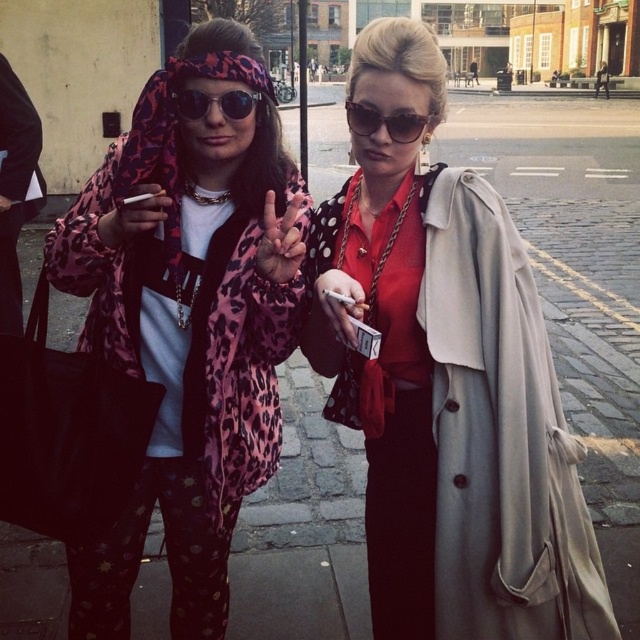
Locate an element on the screen. Image resolution: width=640 pixels, height=640 pixels. matte pink leopard print hand at left is located at coordinates (136, 214).

Is light beige fabric trench coat at center thinner than matte pink leopard print hand at left?

Incorrect, light beige fabric trench coat at center's width is not less than matte pink leopard print hand at left's.

Can you confirm if light beige fabric trench coat at center is taller than matte pink leopard print hand at left?

Yes.

Image resolution: width=640 pixels, height=640 pixels. Identify the location of light beige fabric trench coat at center. click(500, 436).

The image size is (640, 640). Identify the location of light beige fabric trench coat at center. (500, 436).

Which is behind, point (268, 260) or point (138, 202)?

The point (138, 202) is behind.

Is point (289, 234) in front of point (156, 189)?

That is True.

What do you see at coordinates (280, 241) in the screenshot? I see `pink leopard print hand at center` at bounding box center [280, 241].

Identify the location of pink leopard print hand at center. (280, 241).